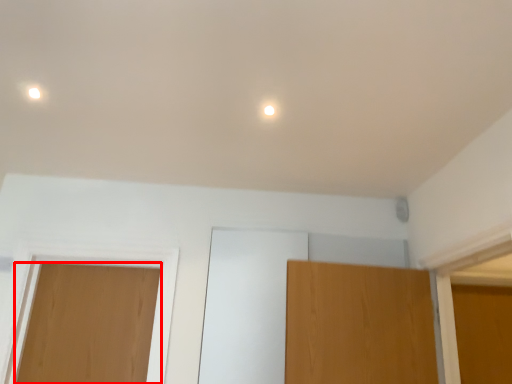
Question: Considering the relative positions of door (annotated by the red box) and dot in the image provided, where is door (annotated by the red box) located with respect to the staircase?

Choices:
 (A) right
 (B) left

Answer: (B)